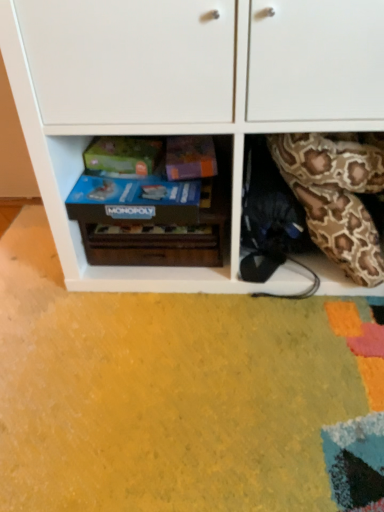
Question: Considering the relative sizes of white matte cabinet at center and blue cardboard monopoly game at center in the image provided, is white matte cabinet at center wider than blue cardboard monopoly game at center?

Choices:
 (A) no
 (B) yes

Answer: (B)

Question: Considering the relative positions of white matte cabinet at center and blue cardboard monopoly game at center in the image provided, is white matte cabinet at center behind blue cardboard monopoly game at center?

Choices:
 (A) yes
 (B) no

Answer: (B)

Question: Is white matte cabinet at center in front of blue cardboard monopoly game at center?

Choices:
 (A) yes
 (B) no

Answer: (A)

Question: Considering the relative positions of white matte cabinet at center and blue cardboard monopoly game at center in the image provided, is white matte cabinet at center to the right of blue cardboard monopoly game at center from the viewer's perspective?

Choices:
 (A) no
 (B) yes

Answer: (B)

Question: Can you confirm if white matte cabinet at center is taller than blue cardboard monopoly game at center?

Choices:
 (A) yes
 (B) no

Answer: (A)

Question: Does point (109, 222) appear closer or farther from the camera than point (228, 210)?

Choices:
 (A) farther
 (B) closer

Answer: (B)

Question: From the image's perspective, is blue cardboard monopoly game at center positioned above or below wooden monopoly game at center?

Choices:
 (A) below
 (B) above

Answer: (B)

Question: Considering the positions of blue cardboard monopoly game at center and wooden monopoly game at center in the image, is blue cardboard monopoly game at center taller or shorter than wooden monopoly game at center?

Choices:
 (A) tall
 (B) short

Answer: (B)

Question: Is blue cardboard monopoly game at center inside the boundaries of wooden monopoly game at center, or outside?

Choices:
 (A) inside
 (B) outside

Answer: (B)

Question: Choose the correct answer: Is brown patterned fabric at right inside wooden monopoly game at center or outside it?

Choices:
 (A) inside
 (B) outside

Answer: (B)

Question: Considering the positions of point (311, 218) and point (92, 257), is point (311, 218) closer or farther from the camera than point (92, 257)?

Choices:
 (A) farther
 (B) closer

Answer: (B)

Question: Considering the relative positions of brown patterned fabric at right and wooden monopoly game at center in the image provided, is brown patterned fabric at right to the left or to the right of wooden monopoly game at center?

Choices:
 (A) left
 (B) right

Answer: (B)

Question: Considering the positions of brown patterned fabric at right and wooden monopoly game at center in the image, is brown patterned fabric at right wider or thinner than wooden monopoly game at center?

Choices:
 (A) wide
 (B) thin

Answer: (B)

Question: Considering the positions of brown patterned fabric at right and white matte cabinet at center in the image, is brown patterned fabric at right taller or shorter than white matte cabinet at center?

Choices:
 (A) short
 (B) tall

Answer: (A)

Question: From a real-world perspective, is brown patterned fabric at right above or below white matte cabinet at center?

Choices:
 (A) below
 (B) above

Answer: (A)